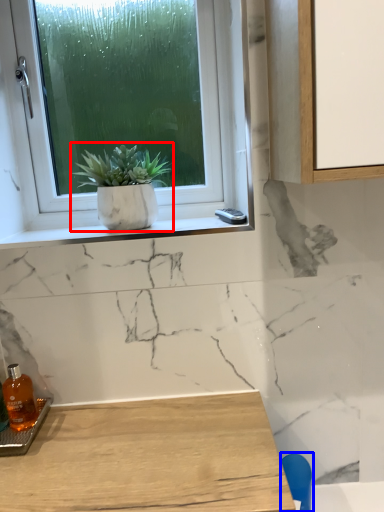
Question: Among these objects, which one is nearest to the camera, houseplant (highlighted by a red box) or chair (highlighted by a blue box)?

Choices:
 (A) houseplant
 (B) chair

Answer: (B)